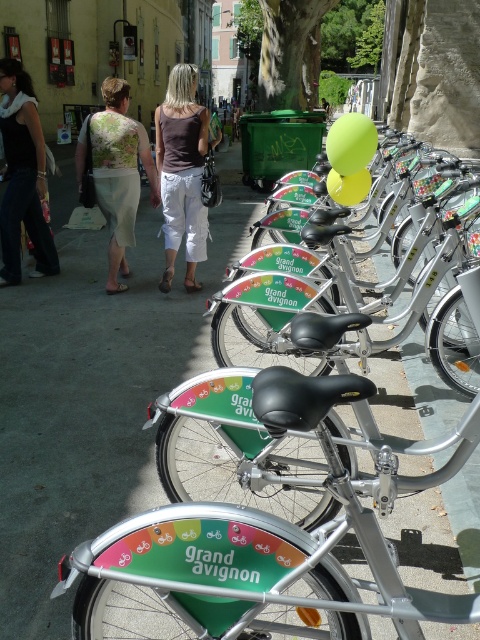
Question: Which point appears closest to the camera in this image?

Choices:
 (A) (120, 256)
 (B) (456, 308)
 (C) (324, 112)

Answer: (B)

Question: Is brown fabric tank top at center in front of black fabric dress at left?

Choices:
 (A) no
 (B) yes

Answer: (B)

Question: Can you confirm if brown fabric tank top at center is positioned below floral fabric dress at left?

Choices:
 (A) no
 (B) yes

Answer: (B)

Question: Among these objects, which one is nearest to the camera?

Choices:
 (A) floral fabric dress at left
 (B) black fabric dress at left
 (C) brown fabric tank top at center
 (D) green fabric bag at center

Answer: (C)

Question: Which object is farther from the camera taking this photo?

Choices:
 (A) silver metallic bicycle at center
 (B) black fabric dress at left

Answer: (B)

Question: Is silver metallic bicycle at center smaller than floral fabric dress at left?

Choices:
 (A) no
 (B) yes

Answer: (A)